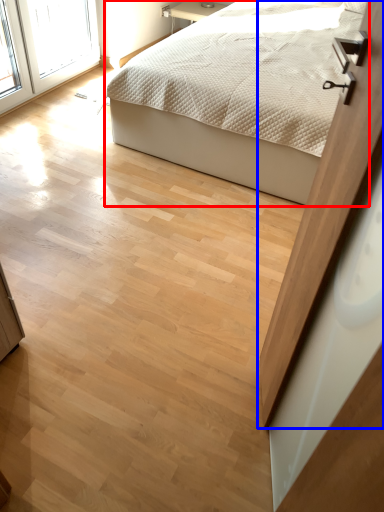
Question: Which point is further to the camera, bed (highlighted by a red box) or screen door (highlighted by a blue box)?

Choices:
 (A) bed
 (B) screen door

Answer: (A)